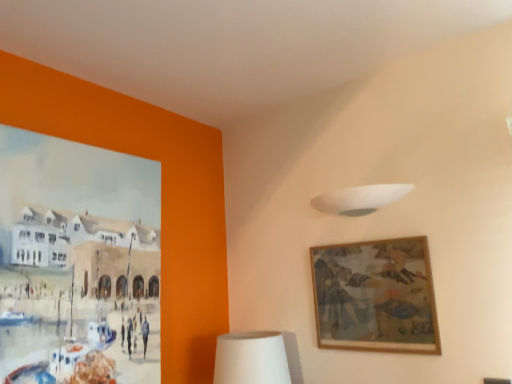
Describe the element at coordinates (376, 296) in the screenshot. I see `wooden framed artwork at upper right` at that location.

Find the location of a particular element. white matte table lamp at lower center is located at coordinates (251, 358).

The width and height of the screenshot is (512, 384). What are the coordinates of `wooden framed artwork at upper right` in the screenshot? It's located at (376, 296).

Consider the image. How different are the orientations of white matte lampshade at upper center and white matte table lamp at lower center in degrees?

There is a 3.42-degree angle between the facing directions of white matte lampshade at upper center and white matte table lamp at lower center.

Between white matte lampshade at upper center and white matte table lamp at lower center, which one has more height?

With more height is white matte table lamp at lower center.

Considering the relative positions of white matte lampshade at upper center and white matte table lamp at lower center in the image provided, is white matte lampshade at upper center to the left or to the right of white matte table lamp at lower center?

white matte lampshade at upper center is positioned on white matte table lamp at lower center's right side.

Which is behind, point (367, 212) or point (258, 380)?

The point (367, 212) is farther.

In terms of size, does wooden framed artwork at upper right appear bigger or smaller than white matte lampshade at upper center?

Considering their sizes, wooden framed artwork at upper right takes up more space than white matte lampshade at upper center.

From the picture: Considering the sizes of objects wooden framed artwork at upper right and white matte lampshade at upper center in the image provided, who is thinner, wooden framed artwork at upper right or white matte lampshade at upper center?

wooden framed artwork at upper right.

Find the location of a particular element. The image size is (512, 384). picture frame below the white matte lampshade at upper center (from a real-world perspective) is located at coordinates click(376, 296).

Can wooden framed artwork at upper right be found inside white matte lampshade at upper center?

No, wooden framed artwork at upper right is not inside white matte lampshade at upper center.

Which of these two, white matte lampshade at upper center or wooden framed artwork at upper right, stands shorter?

With less height is white matte lampshade at upper center.

Which of these two, white matte lampshade at upper center or wooden framed artwork at upper right, is bigger?

Bigger between the two is wooden framed artwork at upper right.

What are the coordinates of `lamp behind the wooden framed artwork at upper right` in the screenshot? It's located at (360, 199).

I want to click on table lamp below the wooden framed artwork at upper right (from the image's perspective), so click(251, 358).

Can you confirm if wooden framed artwork at upper right is bigger than white matte table lamp at lower center?

No, wooden framed artwork at upper right is not bigger than white matte table lamp at lower center.

Consider the image. From a real-world perspective, which is physically below, wooden framed artwork at upper right or white matte table lamp at lower center?

From a 3D spatial view, white matte table lamp at lower center is below.

Does wooden framed artwork at upper right turn towards white matte table lamp at lower center?

No, wooden framed artwork at upper right is not facing towards white matte table lamp at lower center.

This screenshot has height=384, width=512. In the image, there is a white matte lampshade at upper center. What are the coordinates of `table lamp below it (from a real-world perspective)` in the screenshot? It's located at (251, 358).

Does white matte table lamp at lower center appear on the right side of white matte lampshade at upper center?

Incorrect, white matte table lamp at lower center is not on the right side of white matte lampshade at upper center.

Consider the image. Would you consider white matte table lamp at lower center to be distant from white matte lampshade at upper center?

That's not correct — white matte table lamp at lower center is a little close to white matte lampshade at upper center.

Can you confirm if white matte table lamp at lower center is shorter than wooden framed artwork at upper right?

Indeed, white matte table lamp at lower center has a lesser height compared to wooden framed artwork at upper right.

Does point (219, 343) lie in front of point (404, 250)?

No, it is behind (404, 250).

Is white matte table lamp at lower center in front of or behind wooden framed artwork at upper right in the image?

Clearly, white matte table lamp at lower center is behind wooden framed artwork at upper right.

From a real-world perspective, is white matte table lamp at lower center on wooden framed artwork at upper right?

Incorrect, from a real-world perspective, white matte table lamp at lower center is lower than wooden framed artwork at upper right.

Where is `lamp in front of the white matte table lamp at lower center`? The image size is (512, 384). lamp in front of the white matte table lamp at lower center is located at coordinates (360, 199).

Find the location of `lamp above the wooden framed artwork at upper right (from a real-world perspective)`. lamp above the wooden framed artwork at upper right (from a real-world perspective) is located at coordinates (360, 199).

When comparing their distances from white matte table lamp at lower center, does white matte lampshade at upper center or wooden framed artwork at upper right seem further?

Among the two, white matte lampshade at upper center is located further to white matte table lamp at lower center.

Estimate the real-world distances between objects in this image. Which object is further from white matte lampshade at upper center, white matte table lamp at lower center or wooden framed artwork at upper right?

white matte table lamp at lower center lies further to white matte lampshade at upper center than the other object.

From the image, which object appears to be farther from wooden framed artwork at upper right, white matte table lamp at lower center or white matte lampshade at upper center?

white matte table lamp at lower center is positioned further to the anchor wooden framed artwork at upper right.

Estimate the real-world distances between objects in this image. Which object is further from white matte table lamp at lower center, wooden framed artwork at upper right or white matte lampshade at upper center?

Among the two, white matte lampshade at upper center is located further to white matte table lamp at lower center.

Based on their spatial positions, is wooden framed artwork at upper right or white matte table lamp at lower center closer to white matte lampshade at upper center?

wooden framed artwork at upper right is positioned closer to the anchor white matte lampshade at upper center.

Which object lies further to the anchor point wooden framed artwork at upper right, white matte lampshade at upper center or white matte table lamp at lower center?

white matte table lamp at lower center is further to wooden framed artwork at upper right.

The height and width of the screenshot is (384, 512). I want to click on picture frame between white matte lampshade at upper center and white matte table lamp at lower center in the vertical direction, so click(x=376, y=296).